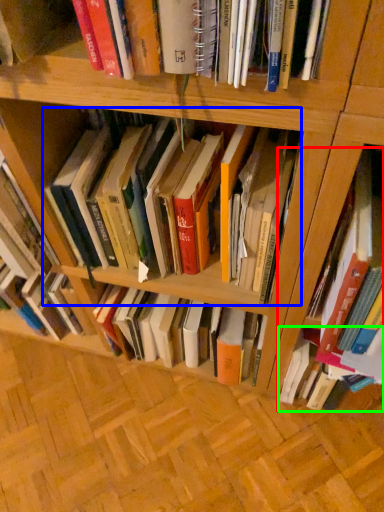
Question: Which object is positioned farthest from book (highlighted by a red box)? Select from book (highlighted by a blue box) and book (highlighted by a green box).

Choices:
 (A) book
 (B) book

Answer: (A)